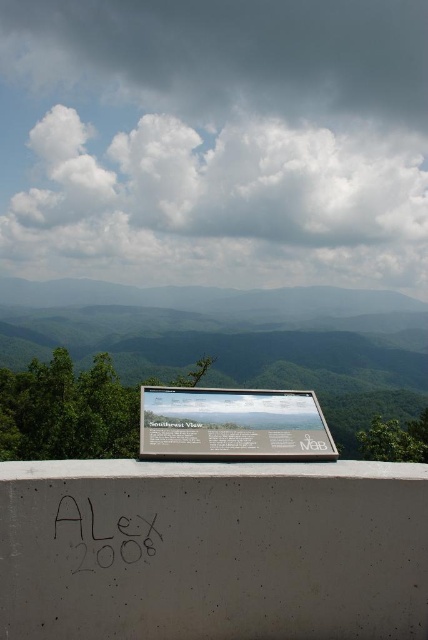
Is concrete at center positioned at the back of white glossy signboard at center?

That is False.

Is concrete at center to the left of white glossy signboard at center from the viewer's perspective?

Yes, concrete at center is to the left of white glossy signboard at center.

Does point (154, 531) come closer to viewer compared to point (246, 410)?

Yes.

This screenshot has width=428, height=640. I want to click on concrete at center, so click(213, 550).

Can you confirm if concrete at center is positioned to the left of black marker graffiti at center?

In fact, concrete at center is to the right of black marker graffiti at center.

Which of these two, concrete at center or black marker graffiti at center, stands taller?

With more height is concrete at center.

Who is more forward, (88, 497) or (83, 506)?

Point (83, 506) is more forward.

Locate an element on the screen. Image resolution: width=428 pixels, height=640 pixels. concrete at center is located at coordinates (213, 550).

Between point (187, 268) and point (253, 426), which one is positioned in front?

Point (253, 426) is more forward.

Find the location of a particular element. This screenshot has height=640, width=428. white fluffy cloud at upper center is located at coordinates [219, 205].